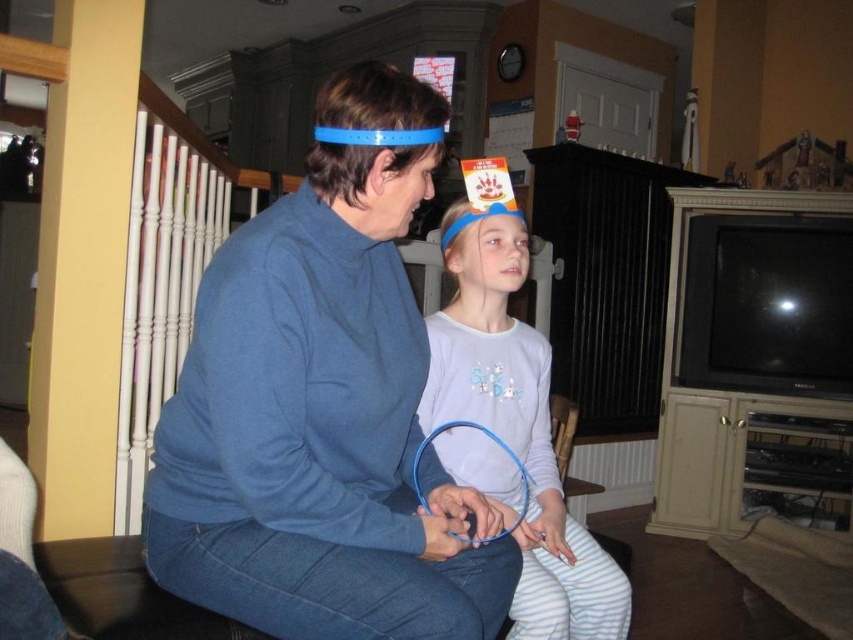
Question: Which of the following is the farthest from the observer?

Choices:
 (A) matte blue sweater at center
 (B) white cotton shirt at center

Answer: (B)

Question: Does matte blue sweater at center appear on the right side of white cotton shirt at center?

Choices:
 (A) yes
 (B) no

Answer: (B)

Question: Observing the image, what is the correct spatial positioning of matte blue sweater at center in reference to white cotton shirt at center?

Choices:
 (A) below
 (B) above

Answer: (B)

Question: Observing the image, what is the correct spatial positioning of matte blue sweater at center in reference to white cotton shirt at center?

Choices:
 (A) right
 (B) left

Answer: (B)

Question: Which point is closer to the camera taking this photo?

Choices:
 (A) (322, 208)
 (B) (605, 582)

Answer: (A)